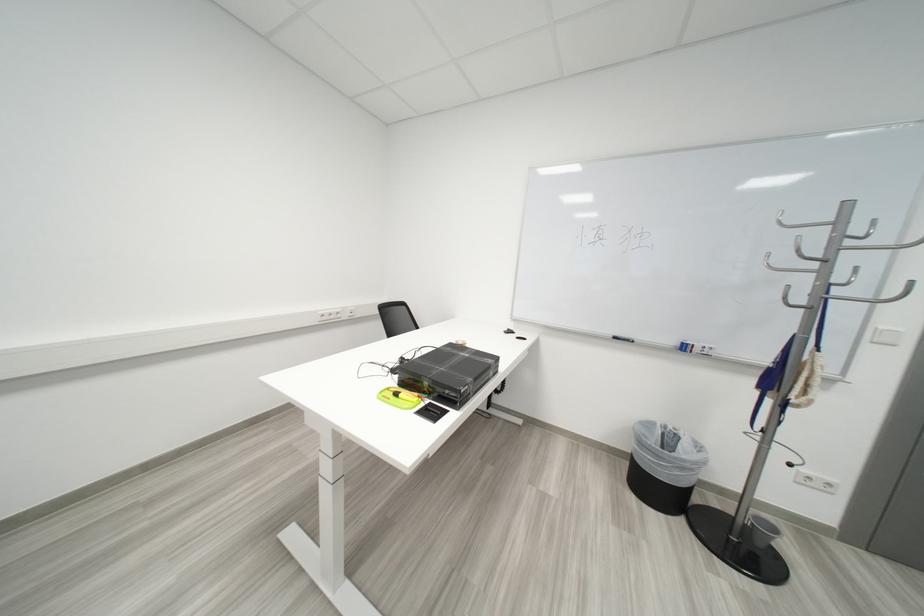
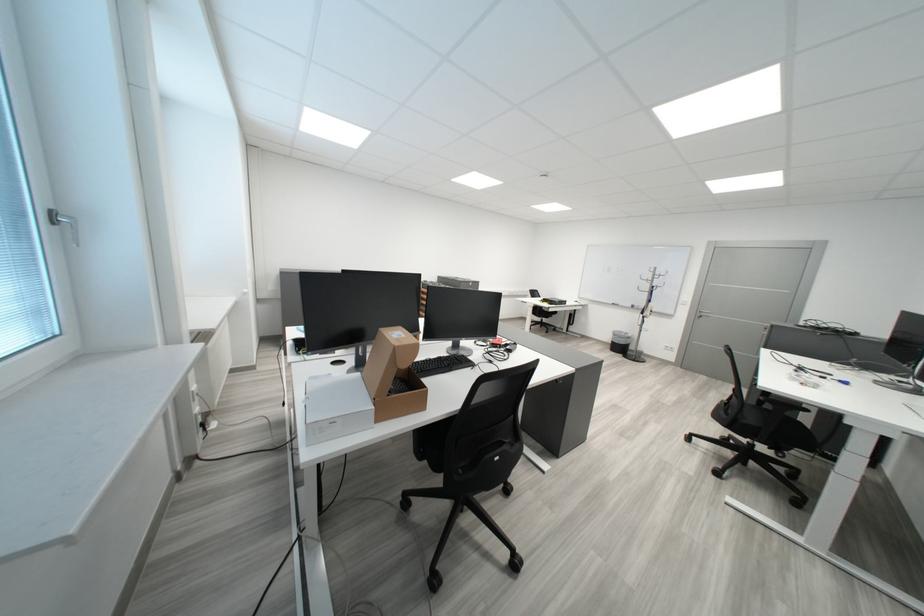
Locate, in the second image, the point that corresponds to pixel 841 262 in the first image.

(665, 283)